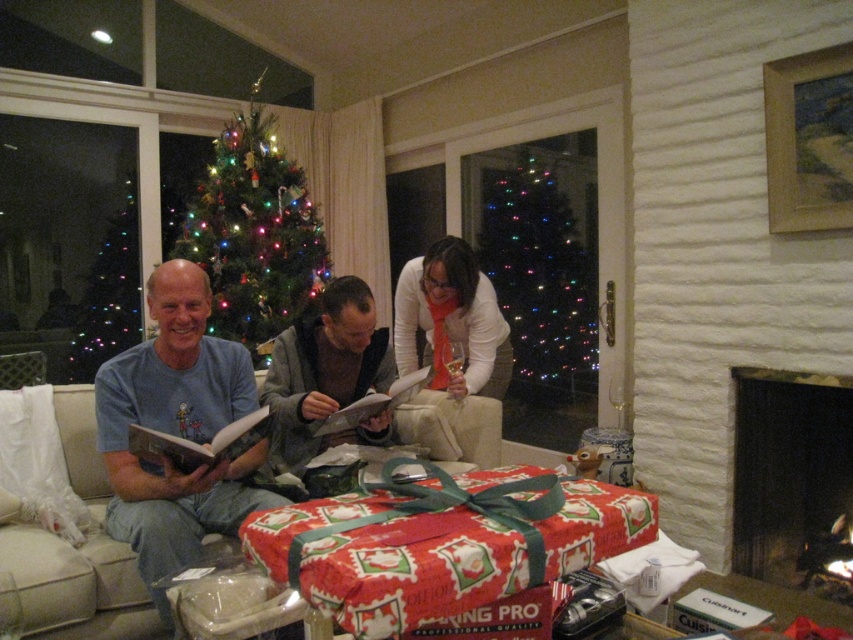
Question: Observing the image, what is the correct spatial positioning of blue cotton shirt at center in reference to iridescent glass christmas tree at center?

Choices:
 (A) above
 (B) below

Answer: (B)

Question: Estimate the real-world distances between objects in this image. Which object is farther from the white matte sweater at center?

Choices:
 (A) black stone fireplace at lower right
 (B) blue cotton shirt at center
 (C) beige fabric couch at center
 (D) green glittering christmas tree at upper left

Answer: (D)

Question: Does iridescent glass christmas tree at center appear on the left side of gray sweater at center?

Choices:
 (A) yes
 (B) no

Answer: (B)

Question: Which object is the farthest from the green glittering christmas tree at upper left?

Choices:
 (A) blue cotton shirt at center
 (B) black stone fireplace at lower right
 (C) white matte sweater at center

Answer: (B)

Question: Does iridescent glass christmas tree at center have a smaller size compared to gray sweater at center?

Choices:
 (A) no
 (B) yes

Answer: (A)

Question: Which object is the farthest from the white matte sweater at center?

Choices:
 (A) beige fabric couch at center
 (B) black stone fireplace at lower right
 (C) iridescent glass christmas tree at center
 (D) green glittering christmas tree at upper left

Answer: (D)